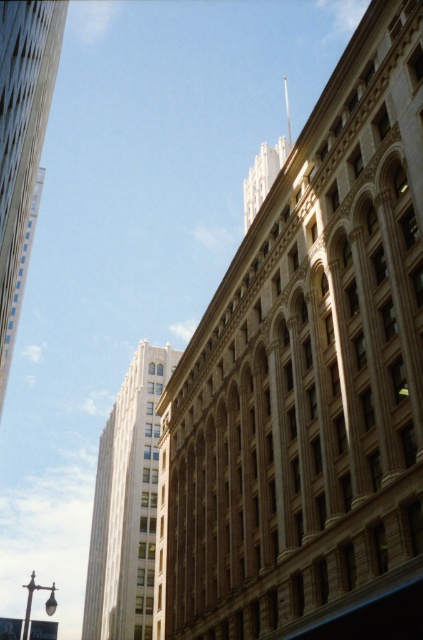
You are a drone operator who needs to fly a drone between the brown stone building at center and the white marble tower at upper left. The drone has a maximum flight distance of 150 feet. Can the drone safely fly between these two structures without exceeding its range?

The brown stone building at center and the white marble tower at upper left are 133.01 feet apart from each other. Since the drone has a maximum flight distance of 150 feet, it can safely fly between them without exceeding its range.

Looking at this image, you are a city planner reviewing this area and need to install a new streetlight. The streetlight must be placed between the brown stone building at center and the white marble tower at upper left. Based on their positions, which side of the streetlight should face the building that is further away from the other?

The brown stone building at center is to the right of the white marble tower at upper left. Therefore, the streetlight should face the white marble tower at upper left since it is further away from the brown stone building at center.

You are a city planner reviewing the city layout. You need to determine if the brown stone building at center will block the view of the white marble tower at upper left from the main plaza. Based on their positions, what can you conclude?

The brown stone building at center is positioned over the white marble tower at upper left, which means it is located in front of or above it, likely blocking the view of the white marble tower at upper left from the main plaza.